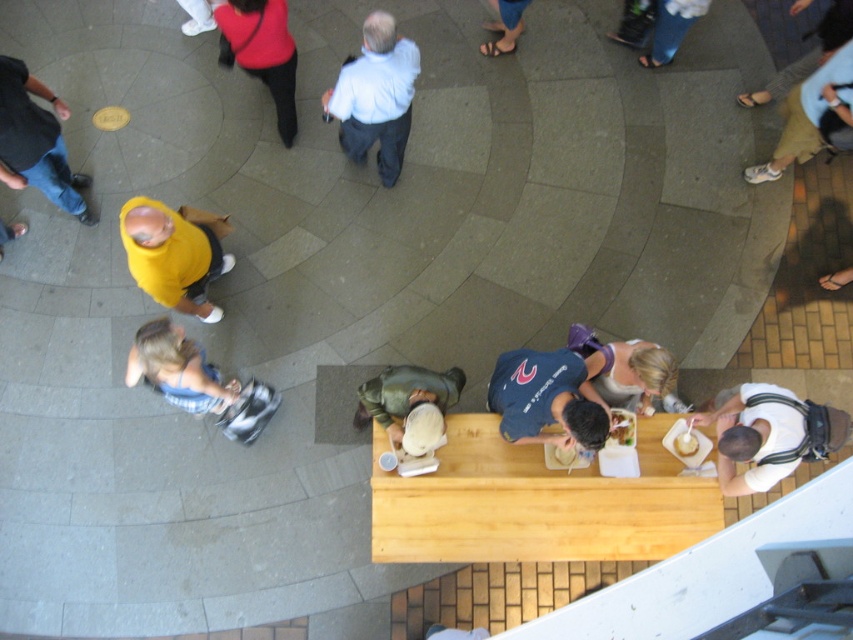
Can you confirm if dark blue t-shirt at center is positioned below blonde hair woman at center?

Indeed, dark blue t-shirt at center is positioned under blonde hair woman at center.

Can you confirm if dark blue t-shirt at center is positioned to the left of blonde hair woman at center?

Correct, you'll find dark blue t-shirt at center to the left of blonde hair woman at center.

Is point (606, 436) positioned after point (630, 339)?

No, it is in front of (630, 339).

The height and width of the screenshot is (640, 853). In order to click on dark blue t-shirt at center in this screenshot , I will do `click(546, 397)`.

Is blonde hair woman at center smaller than white paper bowl at lower center?

Actually, blonde hair woman at center might be larger than white paper bowl at lower center.

Between blonde hair woman at center and white paper bowl at lower center, which one appears on the right side from the viewer's perspective?

Positioned to the right is blonde hair woman at center.

Who is more distant from viewer, (606, 352) or (631, 416)?

The point (631, 416) is behind.

Where is `blonde hair woman at center`? This screenshot has height=640, width=853. blonde hair woman at center is located at coordinates (625, 369).

Does yellow matte shirt at upper left appear over matte yellow shirt at upper left?

No, yellow matte shirt at upper left is not above matte yellow shirt at upper left.

Is point (213, 232) positioned behind point (26, 124)?

Yes, it is.

Is point (155, 236) less distant than point (55, 195)?

Yes, it is in front of point (55, 195).

Identify the location of yellow matte shirt at upper left. (172, 256).